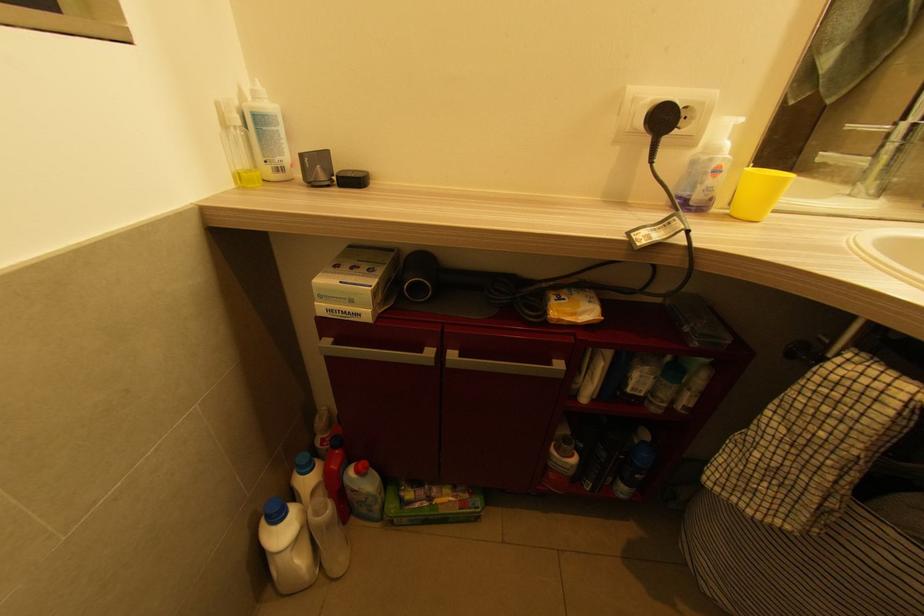
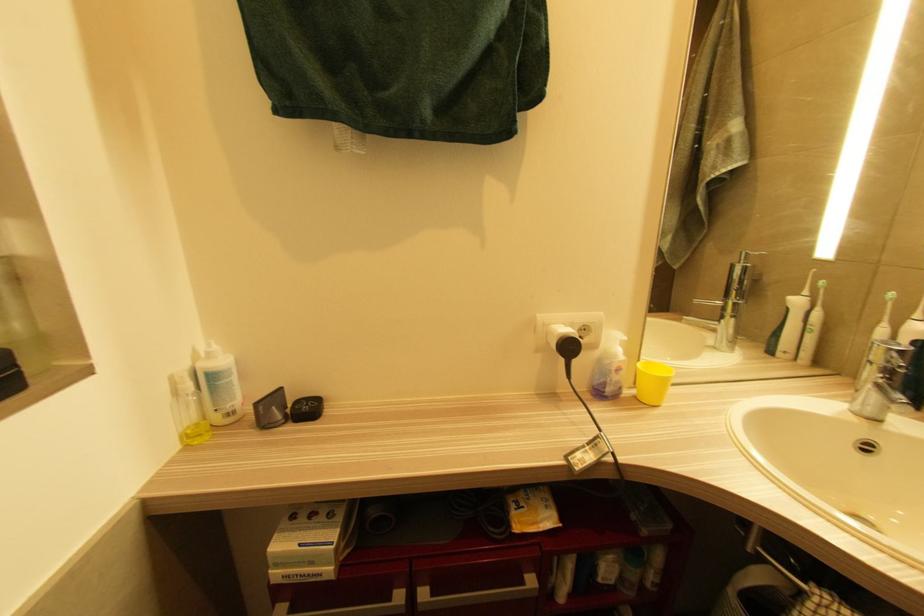
Question: How did the camera likely rotate?

Choices:
 (A) Left
 (B) Right
 (C) Up
 (D) Down

Answer: (C)